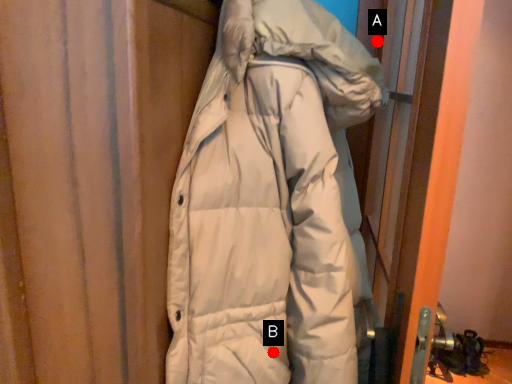
Question: Two points are circled on the image, labeled by A and B beside each circle. Which point appears closest to the camera in this image?

Choices:
 (A) A is closer
 (B) B is closer

Answer: (B)